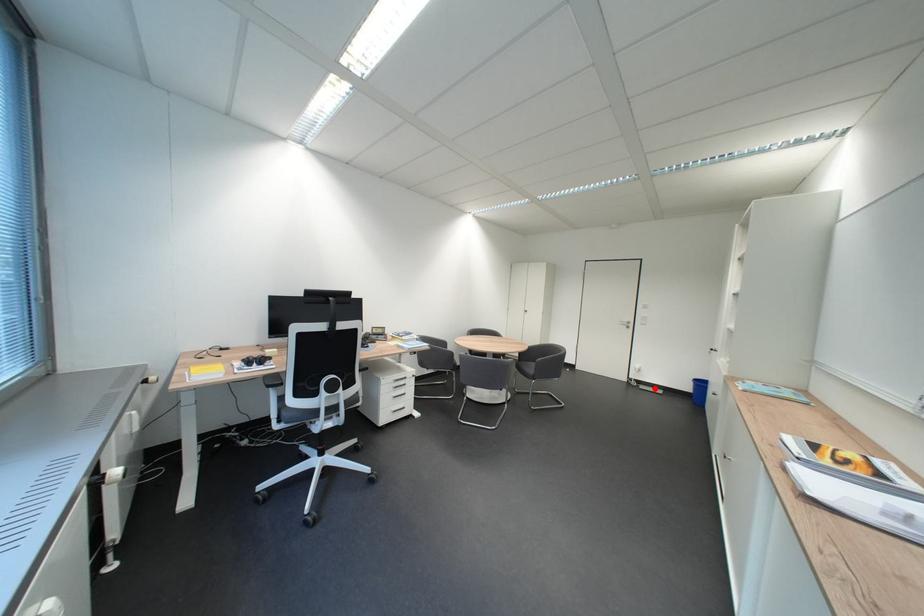
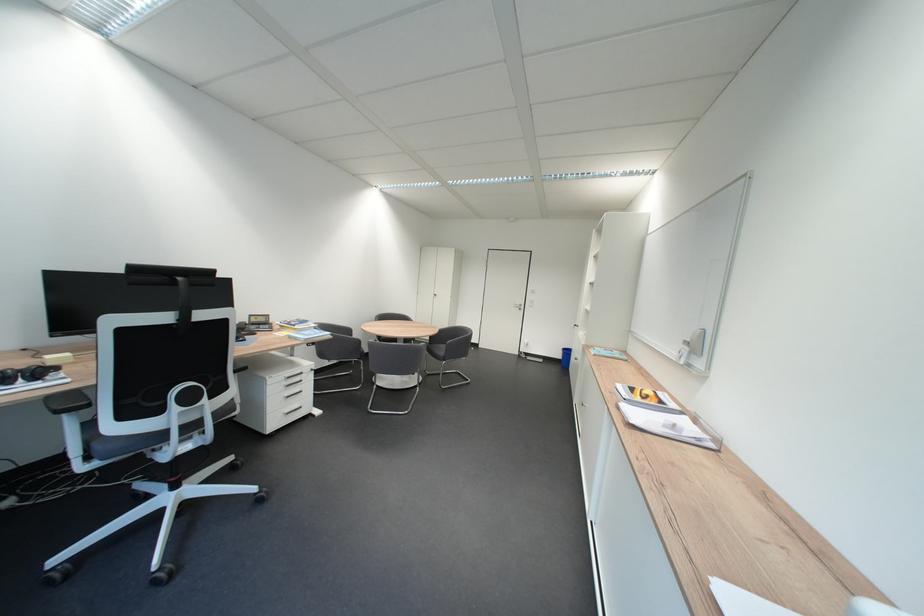
The point at the highlighted location is marked in the first image. Where is the corresponding point in the second image?

(541, 360)